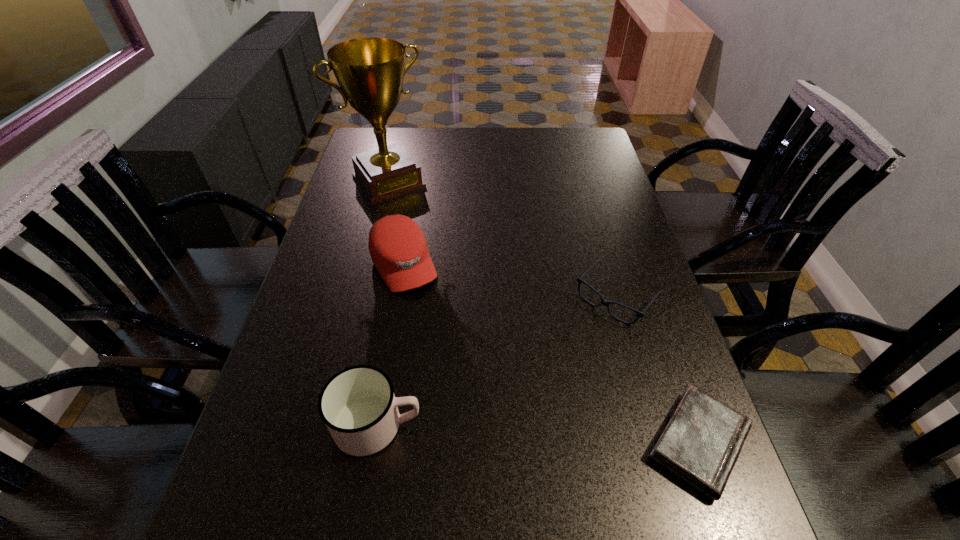
Find the location of `mug`. mug is located at coordinates (358, 406).

Identify the location of the shortest object. (701, 443).

What are the coordinates of `spectacles` in the screenshot? It's located at (605, 303).

The image size is (960, 540). I want to click on cap, so click(398, 249).

Identify the location of the tallest object. The height and width of the screenshot is (540, 960). (370, 71).

Locate an element on the screen. the farthest object is located at coordinates (370, 71).

Where is `vacant space located on the side of the mug with the handle`? The height and width of the screenshot is (540, 960). vacant space located on the side of the mug with the handle is located at coordinates [548, 425].

Find the location of `vacant space located on the left of the shortest object`. vacant space located on the left of the shortest object is located at coordinates (493, 443).

Locate an element on the screen. Image resolution: width=960 pixels, height=540 pixels. free space located on the front-facing side of the fourth tallest object is located at coordinates (564, 355).

Identify the location of free space located on the front-facing side of the fourth tallest object. (577, 342).